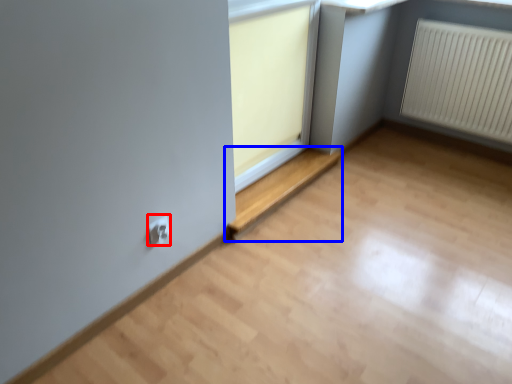
Question: Which of the following is the closest to the observer, electric outlet (highlighted by a red box) or window (highlighted by a blue box)?

Choices:
 (A) electric outlet
 (B) window

Answer: (A)